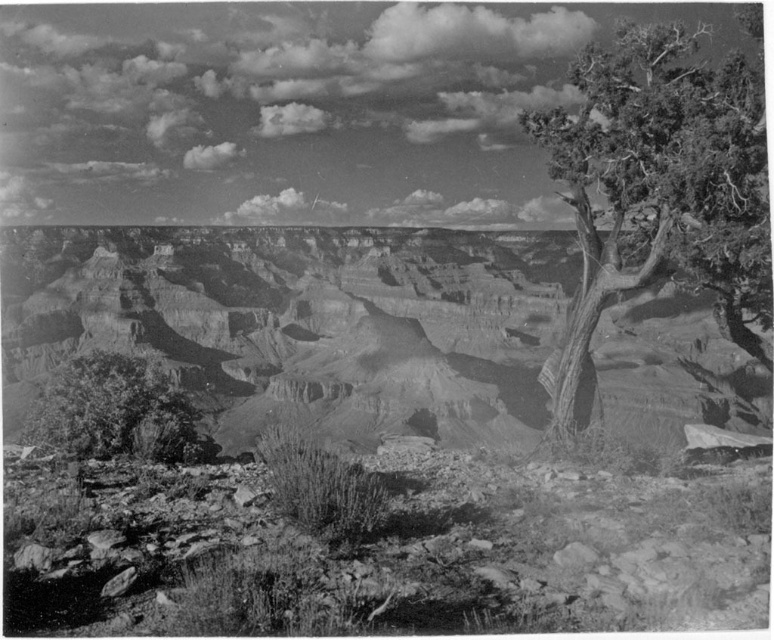
Is point (624, 182) less distant than point (115, 422)?

No, (624, 182) is behind (115, 422).

Describe the element at coordinates (661, 186) in the screenshot. I see `green textured tree at right` at that location.

This screenshot has height=640, width=774. In order to click on green textured tree at right in this screenshot , I will do `click(661, 186)`.

Does rugged rock canyon at center have a lesser height compared to green textured tree at right?

No.

Who is positioned more to the left, rugged rock canyon at center or green textured tree at right?

From the viewer's perspective, rugged rock canyon at center appears more on the left side.

Between point (279, 332) and point (680, 145), which one is positioned in front?

Positioned in front is point (680, 145).

Where is `rugged rock canyon at center`? Image resolution: width=774 pixels, height=640 pixels. rugged rock canyon at center is located at coordinates (302, 323).

From the picture: Is rugged rock canyon at center bigger than grainy gray tree at lower left?

Correct, rugged rock canyon at center is larger in size than grainy gray tree at lower left.

Which of these two, rugged rock canyon at center or grainy gray tree at lower left, stands shorter?

grainy gray tree at lower left is shorter.

Is point (358, 298) closer to viewer compared to point (180, 424)?

No, (358, 298) is behind (180, 424).

Find the location of `rugged rock canyon at center`. rugged rock canyon at center is located at coordinates (302, 323).